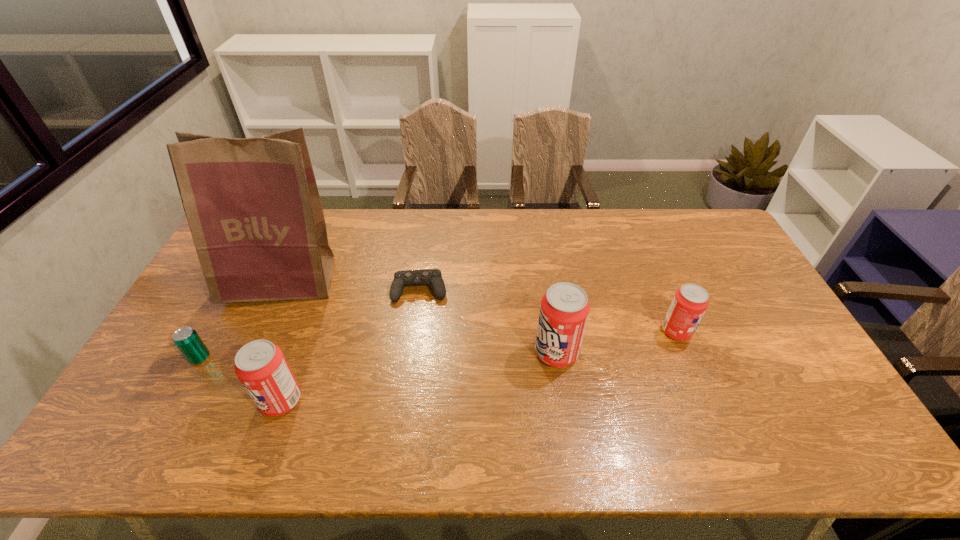
Identify the location of vacant space located 0.140m on the surface of the nearest soda can. (205, 401).

Image resolution: width=960 pixels, height=540 pixels. I want to click on vacant space located on the surface of the nearest soda can, so click(128, 401).

This screenshot has height=540, width=960. I want to click on vacant area situated 0.150m on the surface of the fifth object from left to right, so click(481, 353).

The width and height of the screenshot is (960, 540). I want to click on vacant space positioned 0.120m on the surface of the fifth object from left to right, so click(x=492, y=353).

The image size is (960, 540). Identify the location of vacant space positioned on the surface of the fifth object from left to right. (402, 353).

Where is `free location located 0.070m on the surface of the third shortest object`? free location located 0.070m on the surface of the third shortest object is located at coordinates (715, 332).

Where is `vacant space positioned 0.210m on the front-facing side of the grocery bag`? This screenshot has width=960, height=540. vacant space positioned 0.210m on the front-facing side of the grocery bag is located at coordinates (243, 367).

Find the location of a particular element. Image resolution: width=960 pixels, height=540 pixels. free space located 0.240m on the right of the fifth tallest object is located at coordinates (297, 358).

Where is `free space located 0.140m on the left of the shortest object`? free space located 0.140m on the left of the shortest object is located at coordinates (348, 290).

This screenshot has height=540, width=960. In order to click on object that is positioned at the near edge in this screenshot , I will do `click(260, 365)`.